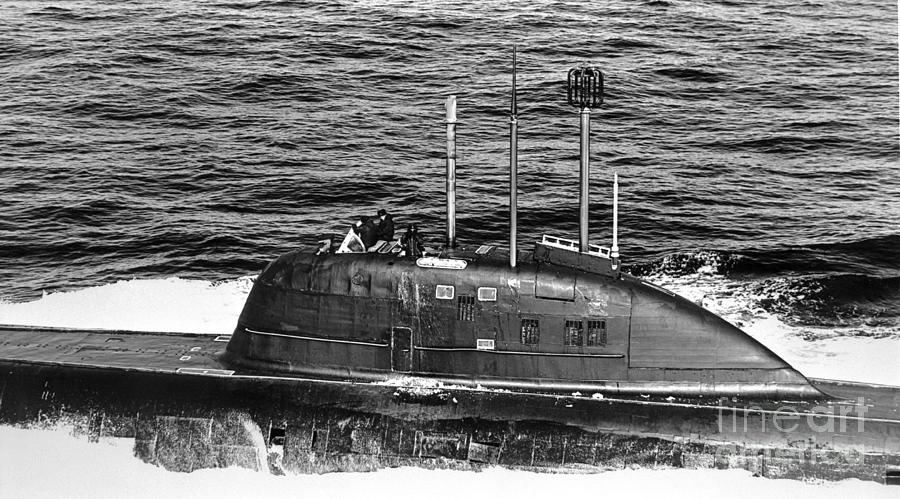
The width and height of the screenshot is (900, 499). In order to click on door in this screenshot , I will do `click(406, 337)`.